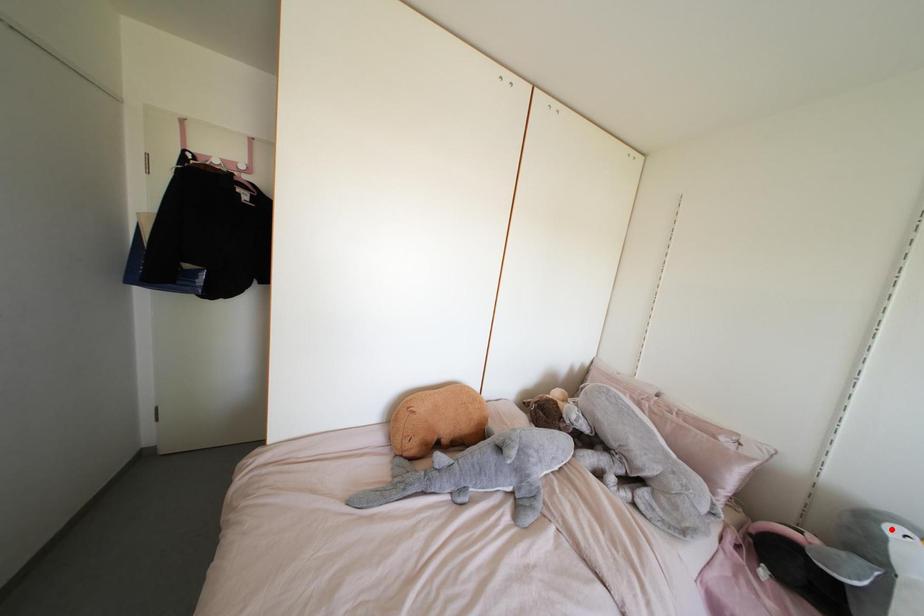
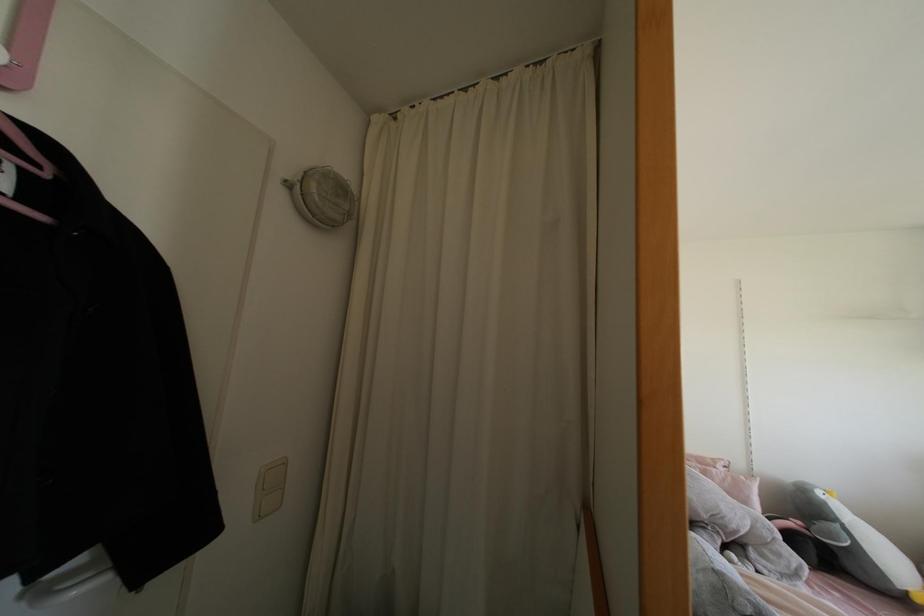
In the second image, find the point that corresponds to the highlighted location in the first image.

(819, 493)